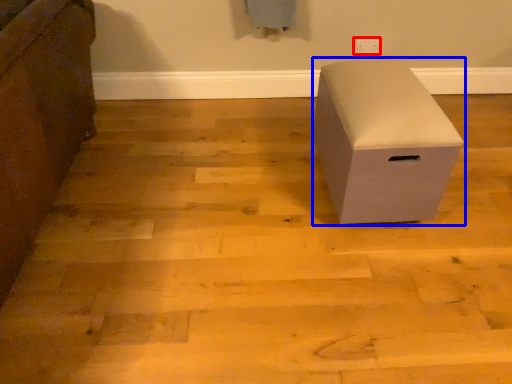
Question: Among these objects, which one is farthest to the camera, electric outlet (highlighted by a red box) or furniture (highlighted by a blue box)?

Choices:
 (A) electric outlet
 (B) furniture

Answer: (A)